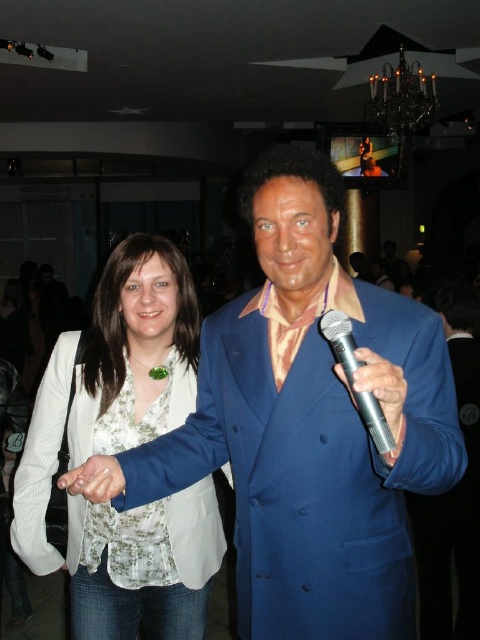
Question: Is blue glossy suit at center bigger than blue velvet suit at center?

Choices:
 (A) yes
 (B) no

Answer: (A)

Question: Estimate the real-world distances between objects in this image. Which object is farther from the white floral fabric dress at center?

Choices:
 (A) silver metallic microphone at right
 (B) metallic silver microphone at right

Answer: (B)

Question: Is blue velvet suit at center above silver metallic microphone at right?

Choices:
 (A) no
 (B) yes

Answer: (A)

Question: Which point is farther from the camera taking this photo?

Choices:
 (A) (382, 403)
 (B) (462, 394)
 (C) (87, 445)
 (D) (433, 397)

Answer: (B)

Question: Estimate the real-world distances between objects in this image. Which object is closer to the metallic silver microphone at right?

Choices:
 (A) white matte hand at center
 (B) white floral fabric dress at center
 (C) blue velvet suit at center

Answer: (A)

Question: Is blue glossy suit at center to the left of metallic silver microphone at right from the viewer's perspective?

Choices:
 (A) no
 (B) yes

Answer: (B)